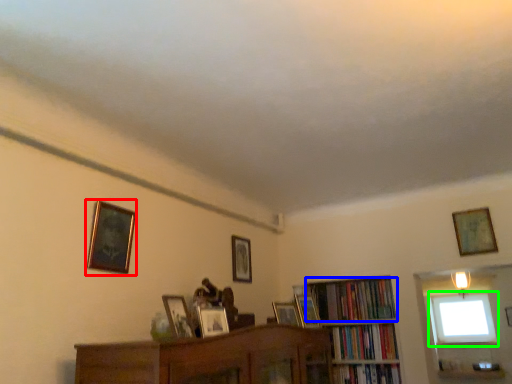
Question: Which object is positioned closest to picture frame (highlighted by a red box)? Select from book (highlighted by a blue box) and window (highlighted by a green box).

Choices:
 (A) book
 (B) window

Answer: (A)